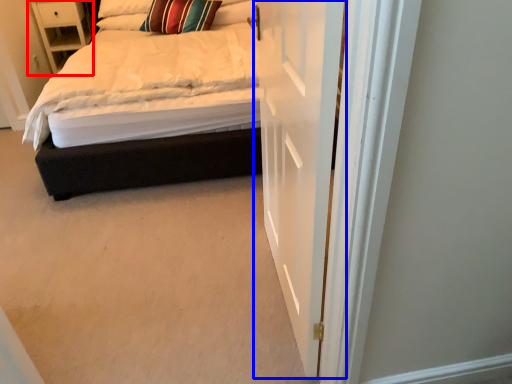
Question: Which of the following is the closest to the observer, nightstand (highlighted by a red box) or door (highlighted by a blue box)?

Choices:
 (A) nightstand
 (B) door

Answer: (B)